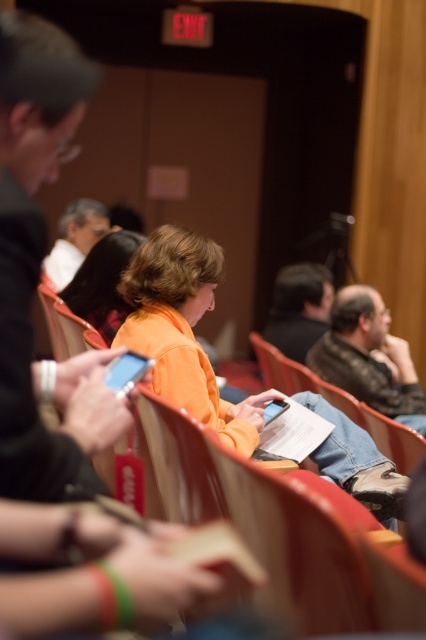
Question: Is orange matte shirt at center bigger than matte white shirt at center?

Choices:
 (A) yes
 (B) no

Answer: (B)

Question: Which point is closer to the camera?

Choices:
 (A) orange matte jacket at center
 (B) orange matte shirt at center

Answer: (A)

Question: Among these points, which one is farthest from the camera?

Choices:
 (A) (58, 380)
 (B) (247, 416)

Answer: (B)

Question: Does matte black phone at left appear on the left side of dark brown hair at center?

Choices:
 (A) no
 (B) yes

Answer: (B)

Question: From the image, what is the correct spatial relationship of matte black phone at left in relation to orange matte jacket at center?

Choices:
 (A) right
 (B) left

Answer: (B)

Question: Based on their relative distances, which object is nearer to the matte white shirt at center?

Choices:
 (A) orange matte shirt at center
 (B) dark brown hair at center

Answer: (A)